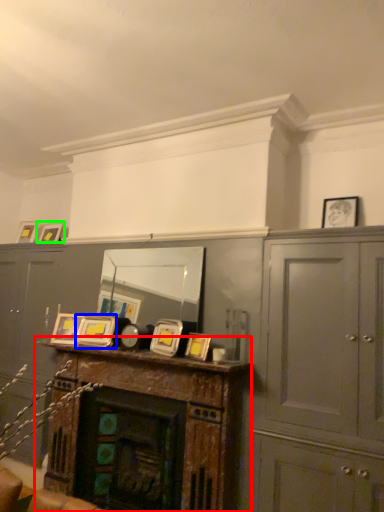
Question: Which object is the farthest from table (highlighted by a red box)? Choose among these: picture frame (highlighted by a blue box) or picture frame (highlighted by a green box).

Choices:
 (A) picture frame
 (B) picture frame

Answer: (B)